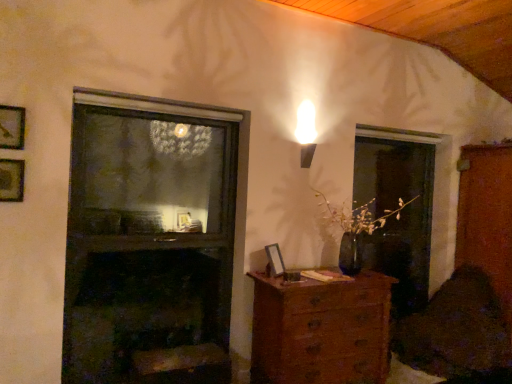
Question: From the image's perspective, is wooden picture frame at lower center, which is the first picture frame in right-to-left order, over wooden file cabinet at right?

Choices:
 (A) no
 (B) yes

Answer: (B)

Question: Considering the relative positions of wooden picture frame at lower center, marked as the 1th picture frame in a bottom-to-top arrangement, and wooden file cabinet at right in the image provided, is wooden picture frame at lower center, marked as the 1th picture frame in a bottom-to-top arrangement, in front of wooden file cabinet at right?

Choices:
 (A) yes
 (B) no

Answer: (A)

Question: Considering the relative sizes of wooden picture frame at lower center, marked as the 1th picture frame in a bottom-to-top arrangement, and wooden file cabinet at right in the image provided, is wooden picture frame at lower center, marked as the 1th picture frame in a bottom-to-top arrangement, shorter than wooden file cabinet at right?

Choices:
 (A) yes
 (B) no

Answer: (A)

Question: From a real-world perspective, is wooden picture frame at lower center, which is the first picture frame from back to front, physically above wooden file cabinet at right?

Choices:
 (A) yes
 (B) no

Answer: (B)

Question: From the image's perspective, would you say wooden picture frame at lower center, which is the first picture frame in right-to-left order, is shown under wooden file cabinet at right?

Choices:
 (A) no
 (B) yes

Answer: (A)

Question: Considering the relative sizes of wooden picture frame at lower center, positioned as the third picture frame in left-to-right order, and wooden file cabinet at right in the image provided, is wooden picture frame at lower center, positioned as the third picture frame in left-to-right order, taller than wooden file cabinet at right?

Choices:
 (A) no
 (B) yes

Answer: (A)

Question: Does wooden picture frame at lower center, which is the first picture frame in right-to-left order, have a greater height compared to wooden picture frame at upper left, the first picture frame when ordered from left to right?

Choices:
 (A) no
 (B) yes

Answer: (A)

Question: Considering the relative sizes of wooden picture frame at lower center, marked as the 1th picture frame in a bottom-to-top arrangement, and wooden picture frame at upper left, the second picture frame viewed from the top, in the image provided, is wooden picture frame at lower center, marked as the 1th picture frame in a bottom-to-top arrangement, smaller than wooden picture frame at upper left, the second picture frame viewed from the top,?

Choices:
 (A) no
 (B) yes

Answer: (A)

Question: Is wooden picture frame at lower center, marked as the 1th picture frame in a bottom-to-top arrangement, next to wooden picture frame at upper left, which is the 2th picture frame in back-to-front order?

Choices:
 (A) yes
 (B) no

Answer: (B)

Question: From the image's perspective, is wooden picture frame at lower center, positioned as the third picture frame in front-to-back order, over wooden picture frame at upper left, which is the 2th picture frame in back-to-front order?

Choices:
 (A) no
 (B) yes

Answer: (A)

Question: From a real-world perspective, is wooden picture frame at lower center, which is the first picture frame from back to front, located beneath wooden picture frame at upper left, marked as the 2th picture frame in a bottom-to-top arrangement?

Choices:
 (A) yes
 (B) no

Answer: (A)

Question: From a real-world perspective, is wooden picture frame at lower center, positioned as the third picture frame in left-to-right order, over wooden picture frame at upper left, marked as the 2th picture frame in a bottom-to-top arrangement?

Choices:
 (A) no
 (B) yes

Answer: (A)

Question: Can you confirm if wooden picture frame at lower center, which is the first picture frame in right-to-left order, is smaller than velvet dark brown swivel chair at lower right?

Choices:
 (A) yes
 (B) no

Answer: (A)